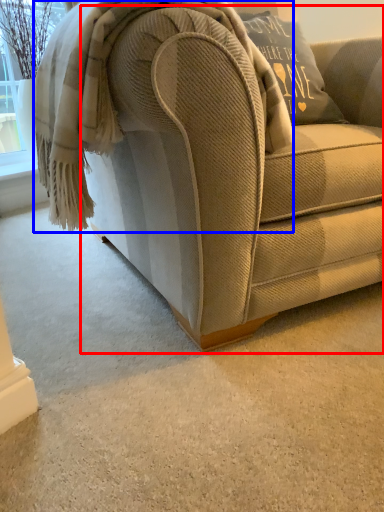
Question: Which point is closer to the camera, studio couch (highlighted by a red box) or blanket (highlighted by a blue box)?

Choices:
 (A) studio couch
 (B) blanket

Answer: (A)